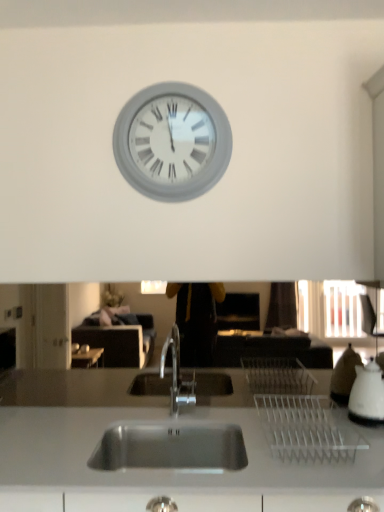
Question: Is white glossy kettle at right positioned behind white matte clock at upper center?

Choices:
 (A) yes
 (B) no

Answer: (B)

Question: Considering the relative sizes of white glossy kettle at right and white matte clock at upper center in the image provided, is white glossy kettle at right shorter than white matte clock at upper center?

Choices:
 (A) yes
 (B) no

Answer: (A)

Question: From the image's perspective, is white glossy kettle at right beneath white matte clock at upper center?

Choices:
 (A) no
 (B) yes

Answer: (B)

Question: Can you confirm if white glossy kettle at right is positioned to the left of white matte clock at upper center?

Choices:
 (A) no
 (B) yes

Answer: (A)

Question: Is white glossy kettle at right beside white matte clock at upper center?

Choices:
 (A) yes
 (B) no

Answer: (B)

Question: Considering the relative sizes of white glossy kettle at right and white matte clock at upper center in the image provided, is white glossy kettle at right taller than white matte clock at upper center?

Choices:
 (A) no
 (B) yes

Answer: (A)

Question: Considering the relative sizes of white matte clock at upper center and white glossy kettle at right in the image provided, is white matte clock at upper center taller than white glossy kettle at right?

Choices:
 (A) yes
 (B) no

Answer: (A)

Question: Is white matte clock at upper center further to camera compared to white glossy kettle at right?

Choices:
 (A) yes
 (B) no

Answer: (A)

Question: Is white matte clock at upper center far from white glossy kettle at right?

Choices:
 (A) no
 (B) yes

Answer: (B)

Question: Considering the relative sizes of white matte clock at upper center and white glossy kettle at right in the image provided, is white matte clock at upper center thinner than white glossy kettle at right?

Choices:
 (A) no
 (B) yes

Answer: (B)

Question: Does white matte clock at upper center turn towards white glossy kettle at right?

Choices:
 (A) no
 (B) yes

Answer: (A)

Question: Is white glossy kettle at right located within white matte clock at upper center?

Choices:
 (A) yes
 (B) no

Answer: (B)

Question: Considering the positions of point (x=362, y=394) and point (x=205, y=94), is point (x=362, y=394) closer or farther from the camera than point (x=205, y=94)?

Choices:
 (A) closer
 (B) farther

Answer: (A)